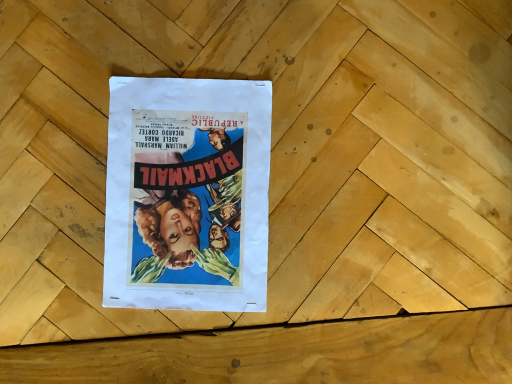
The height and width of the screenshot is (384, 512). What do you see at coordinates (187, 194) in the screenshot?
I see `matte paper poster at center` at bounding box center [187, 194].

Identify the location of matte paper poster at center. The image size is (512, 384). tap(187, 194).

What is the approximate height of matte paper poster at center?

It is 3.10 centimeters.

Identify the location of matte paper poster at center. 187,194.